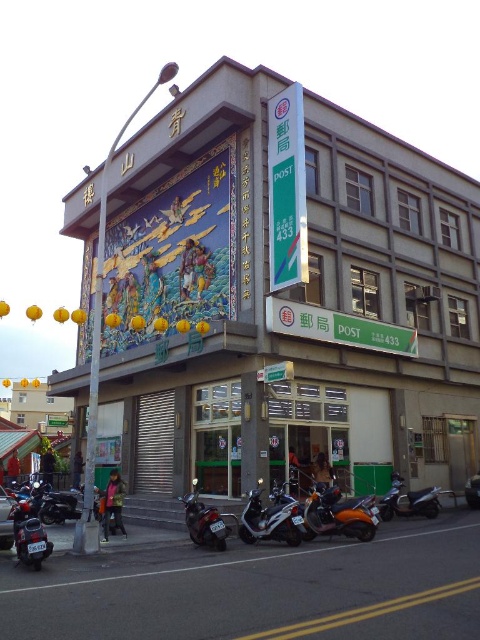
You are a delivery person who needs to park your metallic silver scooter at center and your shiny metallic motorcycle at lower right near the building with the mural. According to the scene, which vehicle should you park closer to the left side of the parking area?

The metallic silver scooter at center should be parked closer to the left side of the parking area because it is positioned to the left of the shiny metallic motorcycle at lower right in the scene.

You are a delivery person who needs to park your motorcycle near the building with the mural. You see the matte black motorcycle at lower left and the shiny metallic motorcycle at lower right. Which motorcycle is parked higher up relative to the building?

The matte black motorcycle at lower left is parked higher up relative to the building than the shiny metallic motorcycle at lower right because it is located above it.